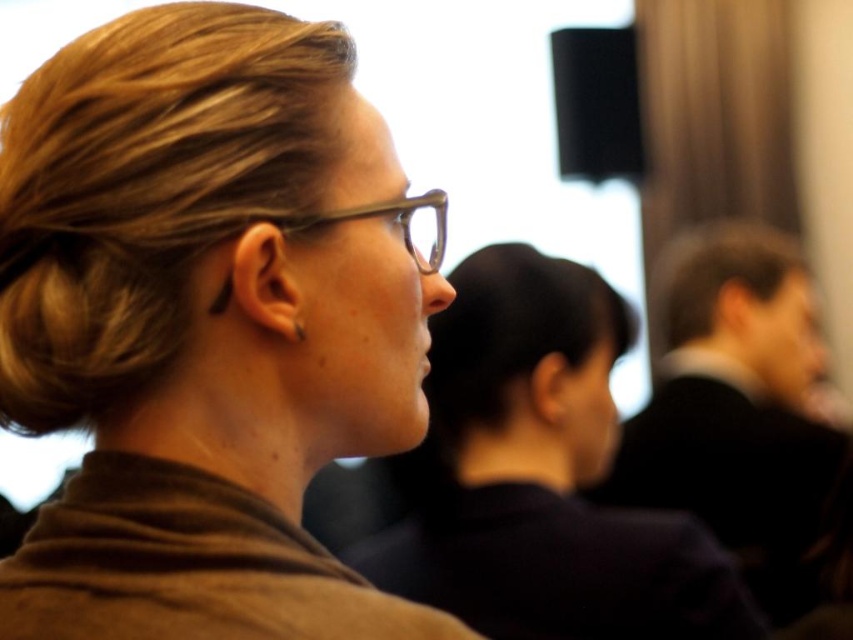
You are an interior designer analyzing the image. The brown matte scarf at upper left and clear plastic glasses at center are in the scene. Which object is positioned lower in the image?

The brown matte scarf at upper left is positioned below the clear plastic glasses at center, so the scarf is lower.

You are a photographer adjusting your camera settings to focus on the transparent plastic glasses at center. The camera can focus on objects within a 20 inch range. Will the glasses be in focus?

The transparent plastic glasses at center is 21.81 inches from viewer, which is beyond the camera focus range of 20 inches. The glasses will not be in focus.

You are a photographer adjusting the focus on your camera. You notice two pairs of glasses in the scene. The transparent plastic glasses at center and the clear plastic glasses at center. Which pair is closer to the camera lens?

The transparent plastic glasses at center is 0.60 centimeters from clear plastic glasses at center, so the transparent plastic glasses at center is closer to the camera lens than the clear plastic glasses at center.